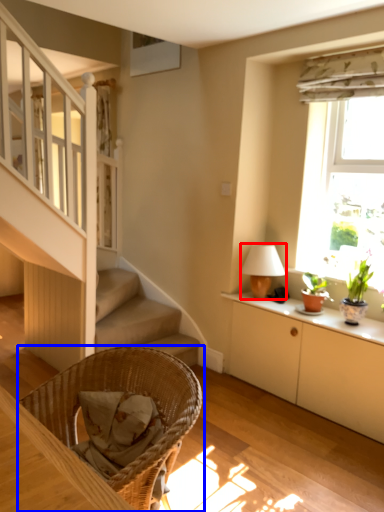
Question: Which object is closer to the camera taking this photo, table lamp (highlighted by a red box) or chair (highlighted by a blue box)?

Choices:
 (A) table lamp
 (B) chair

Answer: (B)